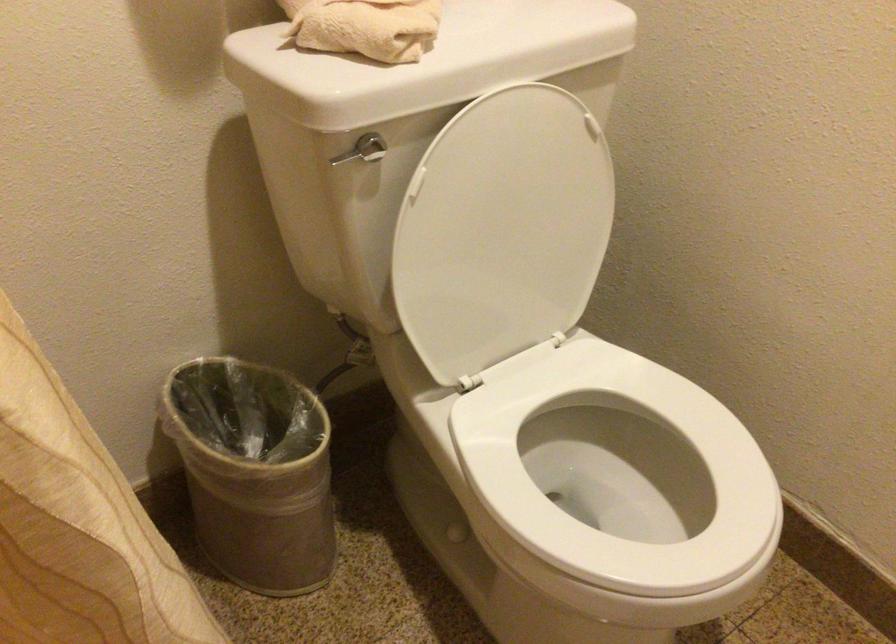
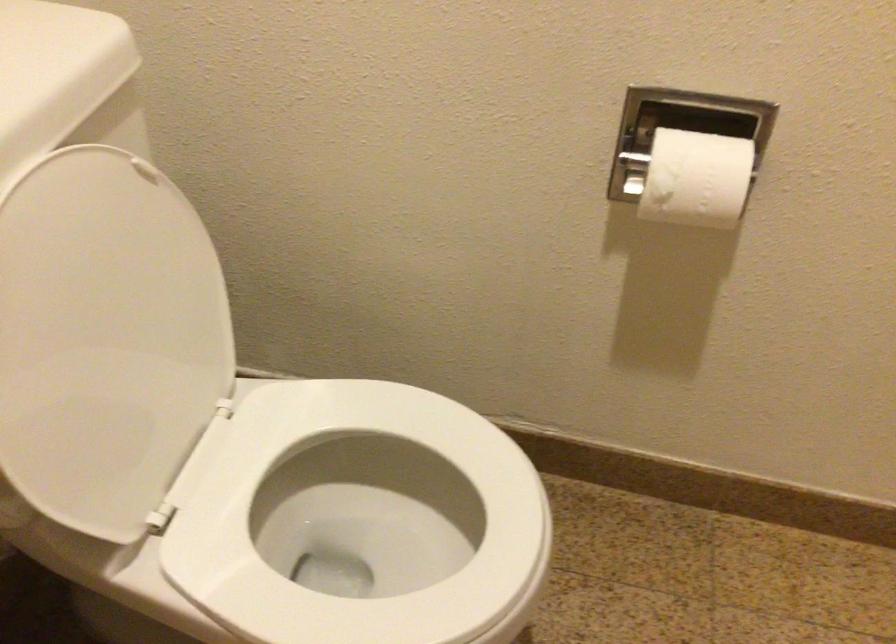
Question: The images are taken continuously from a first-person perspective. In which direction is your viewpoint rotating?

Choices:
 (A) Left
 (B) Right
 (C) Up
 (D) Down

Answer: (B)